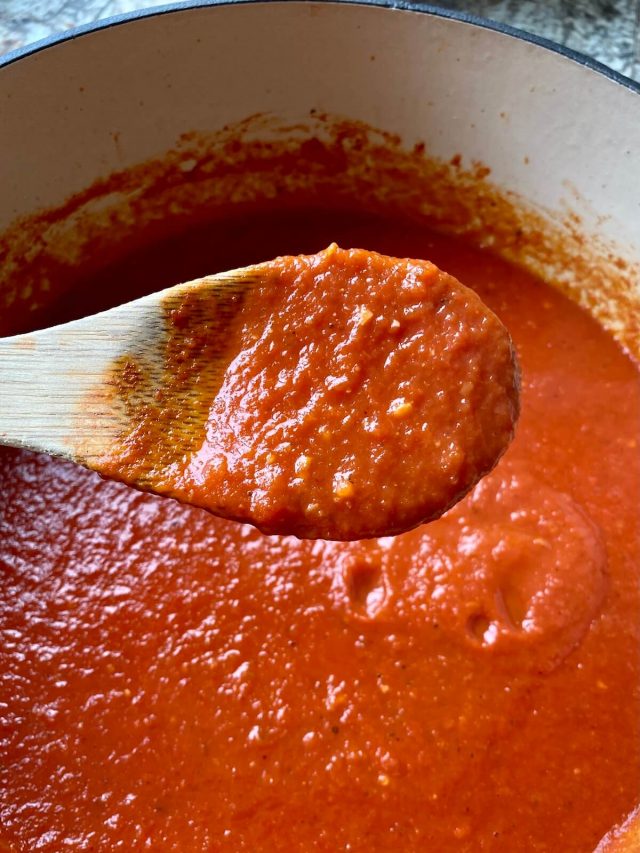
This screenshot has height=853, width=640. In order to click on counter in this screenshot , I will do `click(596, 22)`.